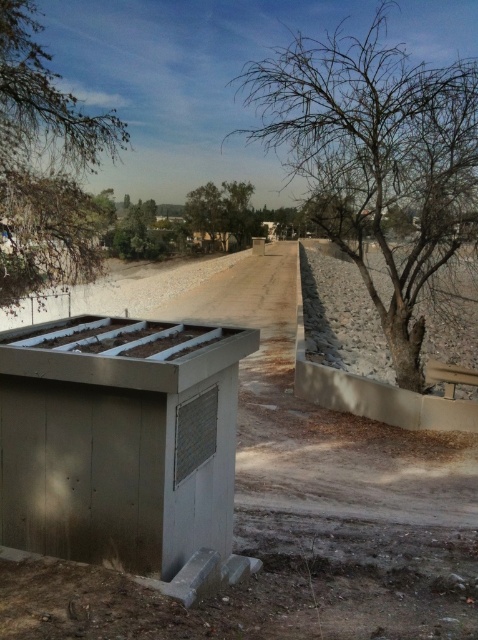
Question: Is green leafy tree at upper left to the left of green leafy tree at center from the viewer's perspective?

Choices:
 (A) yes
 (B) no

Answer: (A)

Question: Does green leafy tree at upper left appear on the right side of green leafy tree at center?

Choices:
 (A) yes
 (B) no

Answer: (B)

Question: Considering the real-world distances, which object is farthest from the green leafy tree at center?

Choices:
 (A) matte gray hut at center
 (B) green leafy tree at upper left
 (C) bare branches at center

Answer: (B)

Question: Which object is positioned farthest from the matte gray hut at center?

Choices:
 (A) green leafy tree at center
 (B) green leafy tree at upper left
 (C) metallic gray hut at center

Answer: (C)

Question: In this image, where is bare branches at center located relative to green leafy tree at center?

Choices:
 (A) below
 (B) above

Answer: (B)

Question: Which object is positioned closest to the metallic gray hut at center?

Choices:
 (A) green leafy tree at upper left
 (B) matte gray hut at center

Answer: (A)